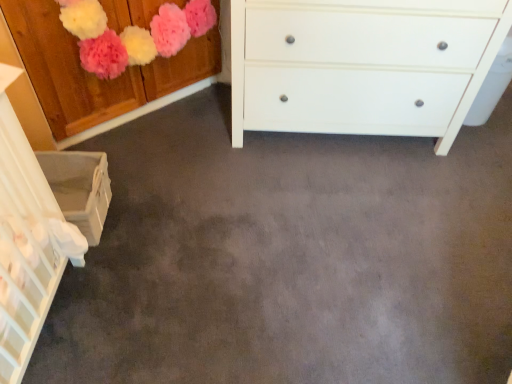
Image resolution: width=512 pixels, height=384 pixels. What are the coordinates of `vacant space that is to the left of white matte chest of drawers at center` in the screenshot? It's located at (173, 153).